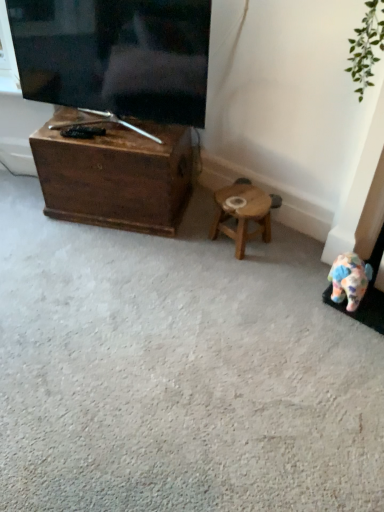
Question: Could wooden chest at left be considered to be inside matte black tv at upper left?

Choices:
 (A) yes
 (B) no

Answer: (B)

Question: Is matte black tv at upper left positioned behind wooden chest at left?

Choices:
 (A) yes
 (B) no

Answer: (B)

Question: Does matte black tv at upper left touch wooden chest at left?

Choices:
 (A) no
 (B) yes

Answer: (A)

Question: Considering the relative sizes of matte black tv at upper left and wooden chest at left in the image provided, is matte black tv at upper left smaller than wooden chest at left?

Choices:
 (A) no
 (B) yes

Answer: (B)

Question: Does matte black tv at upper left have a larger size compared to wooden chest at left?

Choices:
 (A) yes
 (B) no

Answer: (B)

Question: Considering their positions, is wooden stool at center located in front of or behind matte black tv at upper left?

Choices:
 (A) front
 (B) behind

Answer: (B)

Question: Choose the correct answer: Is wooden stool at center inside matte black tv at upper left or outside it?

Choices:
 (A) outside
 (B) inside

Answer: (A)

Question: Considering the positions of wooden stool at center and matte black tv at upper left in the image, is wooden stool at center taller or shorter than matte black tv at upper left?

Choices:
 (A) short
 (B) tall

Answer: (A)

Question: From the image's perspective, relative to matte black tv at upper left, is wooden stool at center above or below?

Choices:
 (A) below
 (B) above

Answer: (A)

Question: From a real-world perspective, is wooden chest at left physically located above or below matte black tv at upper left?

Choices:
 (A) below
 (B) above

Answer: (A)

Question: Is wooden chest at left situated inside matte black tv at upper left or outside?

Choices:
 (A) inside
 (B) outside

Answer: (B)

Question: In the image, is wooden chest at left positioned in front of or behind matte black tv at upper left?

Choices:
 (A) front
 (B) behind

Answer: (B)

Question: Is wooden chest at left bigger or smaller than matte black tv at upper left?

Choices:
 (A) small
 (B) big

Answer: (B)

Question: In the image, is matte black tv at upper left positioned in front of or behind wooden chest at left?

Choices:
 (A) behind
 (B) front

Answer: (B)

Question: Is matte black tv at upper left to the left or to the right of wooden chest at left in the image?

Choices:
 (A) left
 (B) right

Answer: (A)